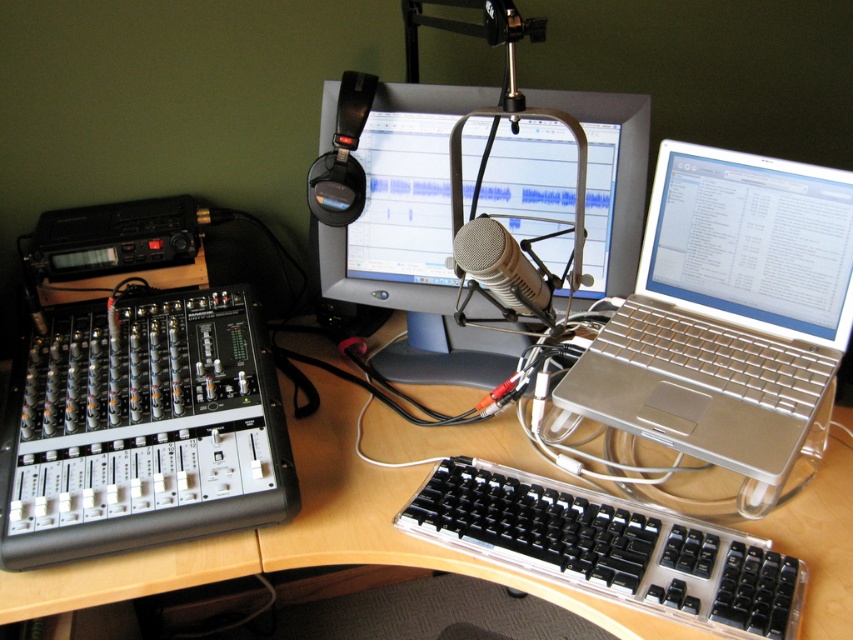
You are setting up a new microphone stand in your home studio. You want to place it behind the clear plastic keyboard at center so that the silver metallic microphone at center can be positioned above the keyboard without touching it. Is this possible based on their heights?

The clear plastic keyboard at center is taller than the silver metallic microphone at center. Since the microphone is shorter, placing it above the keyboard would require it to be elevated enough to avoid contact, which is feasible as the keyboard itself is taller, providing space above it for the microphone stand to position the mic without touching.

Based on the photo, you are a sound engineer who needs to place a 10 inch long cable between the silver metallic laptop at center and the silver metallic microphone at center. Is the space between them sufficient for the cable?

The distance between the silver metallic laptop at center and the silver metallic microphone at center is 7.82 inches, so the 10 inch cable is longer than the required space. Therefore, the cable will fit with some extra length remaining.